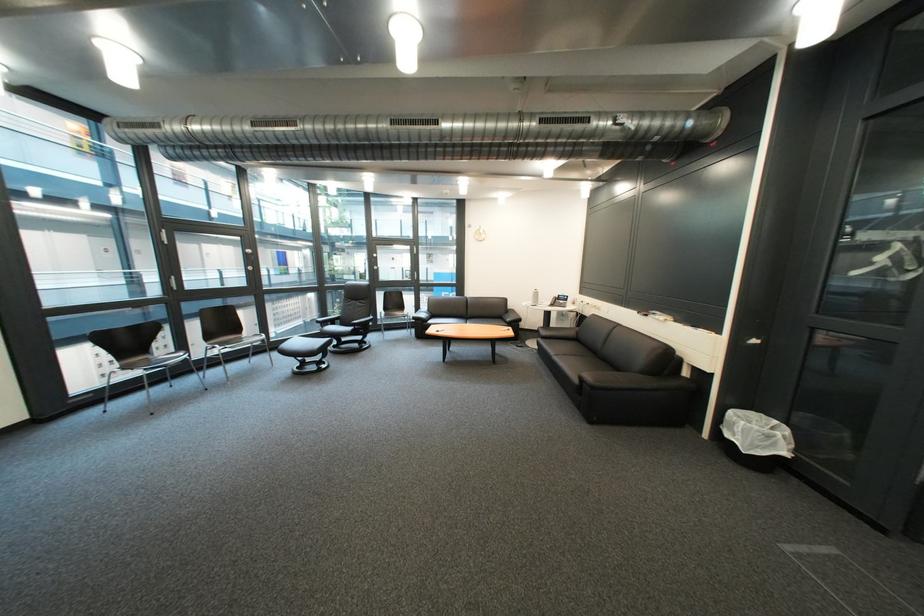
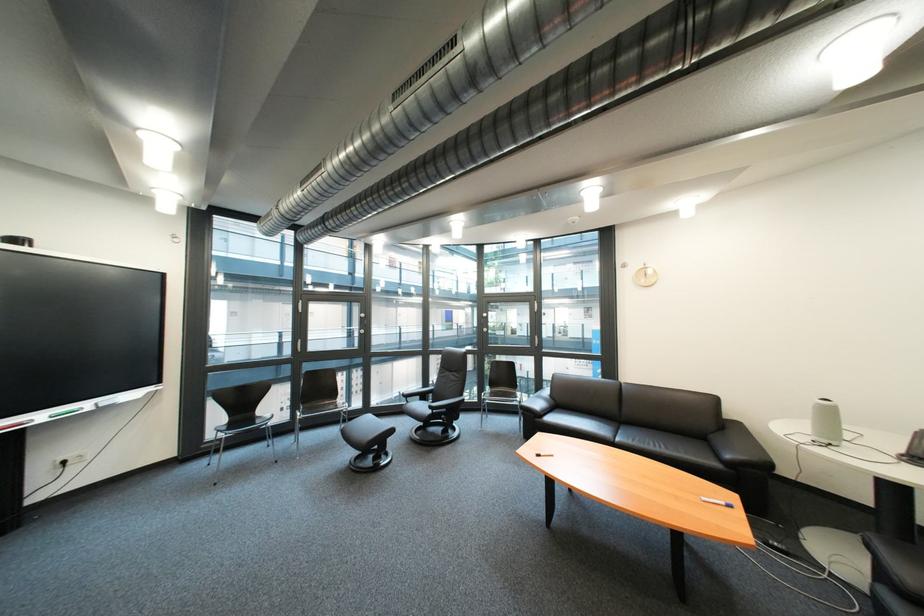
Where in the second image is the point corresponding to pixel 521 322 from the first image?

(742, 458)